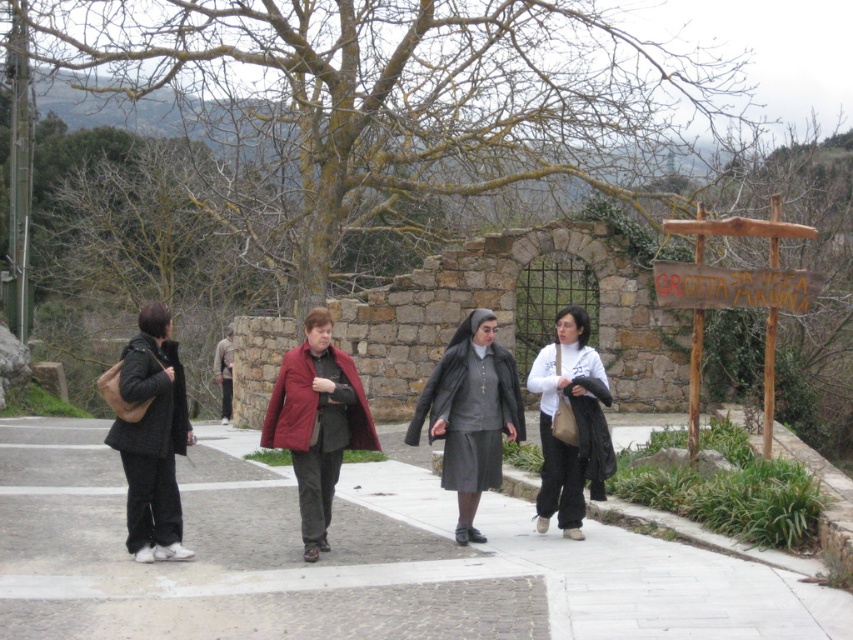
Can you confirm if matte red coat at center is bigger than wooden sign at right?

Yes, matte red coat at center is bigger than wooden sign at right.

Between point (321, 419) and point (676, 268), which one is positioned behind?

Positioned behind is point (676, 268).

Which is in front, point (332, 468) or point (653, 266)?

Positioned in front is point (332, 468).

What are the coordinates of `matte red coat at center` in the screenshot? It's located at (317, 422).

Does white concrete pavement at lower center appear on the right side of white matte jacket at center?

In fact, white concrete pavement at lower center is to the left of white matte jacket at center.

Measure the distance from white concrete pavement at lower center to white matte jacket at center.

white concrete pavement at lower center and white matte jacket at center are 2.58 meters apart from each other.

What do you see at coordinates (352, 561) in the screenshot? I see `white concrete pavement at lower center` at bounding box center [352, 561].

I want to click on white concrete pavement at lower center, so click(352, 561).

Can you confirm if white concrete pavement at lower center is positioned to the left of matte red coat at center?

Indeed, white concrete pavement at lower center is positioned on the left side of matte red coat at center.

Can you confirm if white concrete pavement at lower center is positioned to the right of matte red coat at center?

In fact, white concrete pavement at lower center is to the left of matte red coat at center.

Where is `white concrete pavement at lower center`? white concrete pavement at lower center is located at coordinates (352, 561).

You are a GUI agent. You are given a task and a screenshot of the screen. Output one action in this format:
    pyautogui.click(x=<x>, y=<y>)
    Task: Click on the white concrete pavement at lower center
    This screenshot has height=640, width=853.
    Given the screenshot: What is the action you would take?
    pyautogui.click(x=352, y=561)